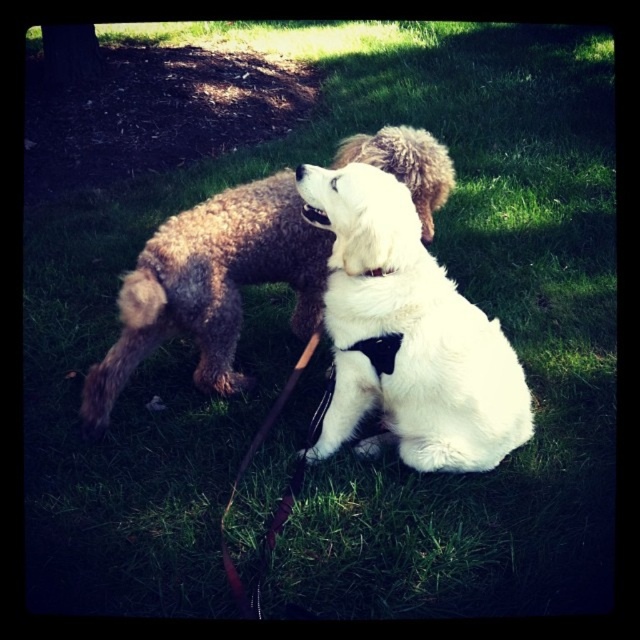
You are a dog trainer observing the white fluffy dog at center and the black fabric neckband at center. Which object is taller?

The white fluffy dog at center is taller than the black fabric neckband at center.

Looking at this image, you are a photographer trying to capture the white fluffy dog at center and the black fabric neckband at center in a single shot. Since the neckband is part of the dog, will you need to adjust your camera angle to ensure both are visible?

The white fluffy dog at center is located above the black fabric neckband at center, so adjusting the camera angle slightly downward might help ensure both are visible in the shot.